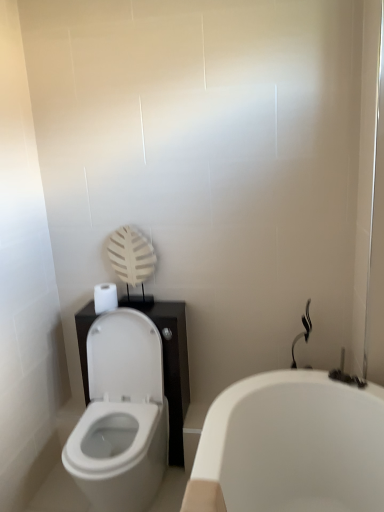
Question: Considering the relative positions of white glossy toilet at lower left and white glossy bathtub at lower right in the image provided, is white glossy toilet at lower left behind white glossy bathtub at lower right?

Choices:
 (A) yes
 (B) no

Answer: (A)

Question: Is white glossy toilet at lower left turned away from white glossy bathtub at lower right?

Choices:
 (A) yes
 (B) no

Answer: (B)

Question: From a real-world perspective, does white glossy toilet at lower left stand above white glossy bathtub at lower right?

Choices:
 (A) no
 (B) yes

Answer: (B)

Question: Is white glossy toilet at lower left completely or partially outside of white glossy bathtub at lower right?

Choices:
 (A) yes
 (B) no

Answer: (A)

Question: Does white glossy toilet at lower left have a lesser width compared to white glossy bathtub at lower right?

Choices:
 (A) no
 (B) yes

Answer: (B)

Question: Based on their positions, is white matte toilet paper at left located to the left or right of black glossy shower at right?

Choices:
 (A) right
 (B) left

Answer: (B)

Question: In terms of height, does white matte toilet paper at left look taller or shorter compared to black glossy shower at right?

Choices:
 (A) short
 (B) tall

Answer: (A)

Question: Relative to black glossy shower at right, is white matte toilet paper at left in front or behind?

Choices:
 (A) behind
 (B) front

Answer: (A)

Question: From a real-world perspective, relative to black glossy shower at right, is white matte toilet paper at left vertically above or below?

Choices:
 (A) above
 (B) below

Answer: (A)

Question: In the image, is black glossy shower at right on the left side or the right side of white glossy toilet at lower left?

Choices:
 (A) right
 (B) left

Answer: (A)

Question: From the image's perspective, is black glossy shower at right above or below white glossy toilet at lower left?

Choices:
 (A) below
 (B) above

Answer: (B)

Question: From a real-world perspective, is black glossy shower at right physically located above or below white glossy toilet at lower left?

Choices:
 (A) below
 (B) above

Answer: (B)

Question: Is black glossy shower at right spatially inside white glossy toilet at lower left, or outside of it?

Choices:
 (A) outside
 (B) inside

Answer: (A)

Question: Is white glossy toilet at lower left in front of or behind black glossy shower at right in the image?

Choices:
 (A) front
 (B) behind

Answer: (A)

Question: Based on their sizes in the image, would you say white glossy toilet at lower left is bigger or smaller than black glossy shower at right?

Choices:
 (A) big
 (B) small

Answer: (A)